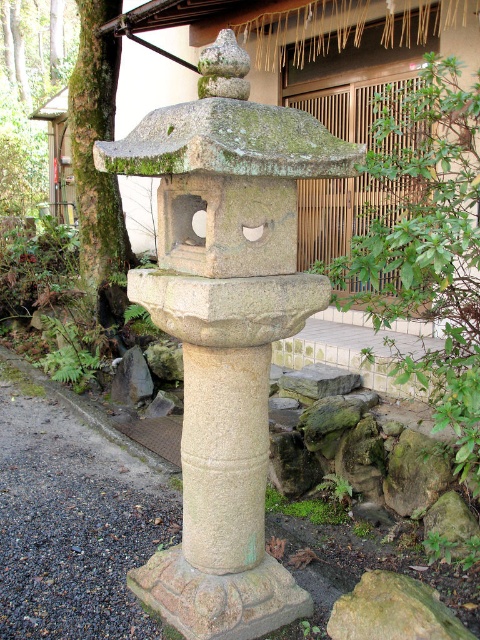
Question: Is green stone lantern at center closer to camera compared to green mossy bark at left?

Choices:
 (A) no
 (B) yes

Answer: (B)

Question: Is green stone lantern at center to the right of green mossy bark at left from the viewer's perspective?

Choices:
 (A) yes
 (B) no

Answer: (A)

Question: Among these points, which one is nearest to the camera?

Choices:
 (A) (101, 106)
 (B) (244, 173)

Answer: (B)

Question: Can you confirm if green stone lantern at center is bigger than green mossy bark at left?

Choices:
 (A) yes
 (B) no

Answer: (B)